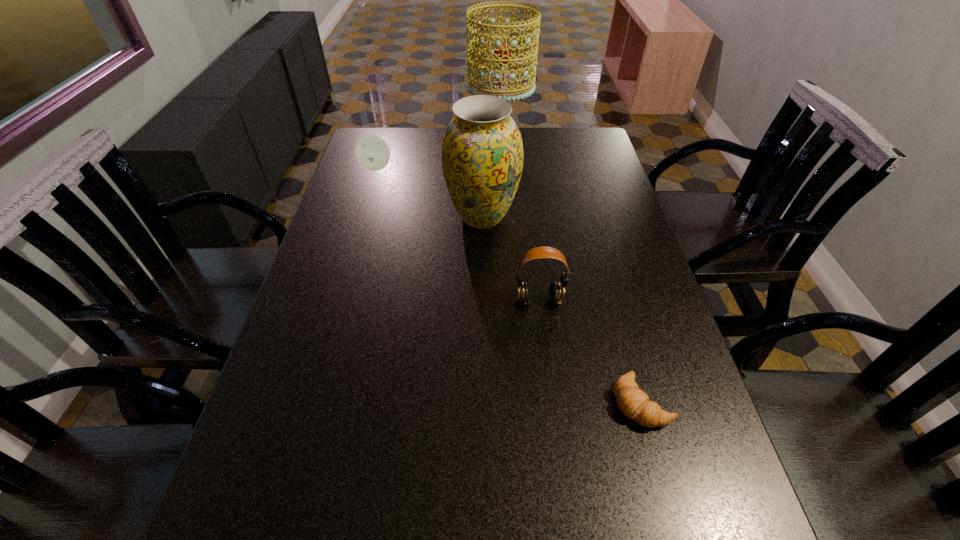
Locate an element on the screen. This screenshot has height=540, width=960. the tallest object is located at coordinates (x=502, y=58).

I want to click on the third farthest object, so click(482, 151).

At what (x,y) coordinates should I click in order to perform the action: click on vase. Please return your answer as a coordinate pair (x, y). Image resolution: width=960 pixels, height=540 pixels. Looking at the image, I should click on (482, 151).

This screenshot has width=960, height=540. I want to click on headset, so pyautogui.click(x=556, y=294).

This screenshot has height=540, width=960. I want to click on the third shortest object, so click(x=556, y=294).

Where is `apple`? The height and width of the screenshot is (540, 960). apple is located at coordinates (372, 152).

At what (x,y) coordinates should I click in order to perform the action: click on the fourth tallest object. Please return your answer as a coordinate pair (x, y). Looking at the image, I should click on (372, 152).

The height and width of the screenshot is (540, 960). Identify the location of crescent roll. (634, 403).

The image size is (960, 540). I want to click on the rightmost object, so click(634, 403).

Find the location of a particular element. This screenshot has width=960, height=540. vacant space located on the front of the tallest object is located at coordinates (503, 211).